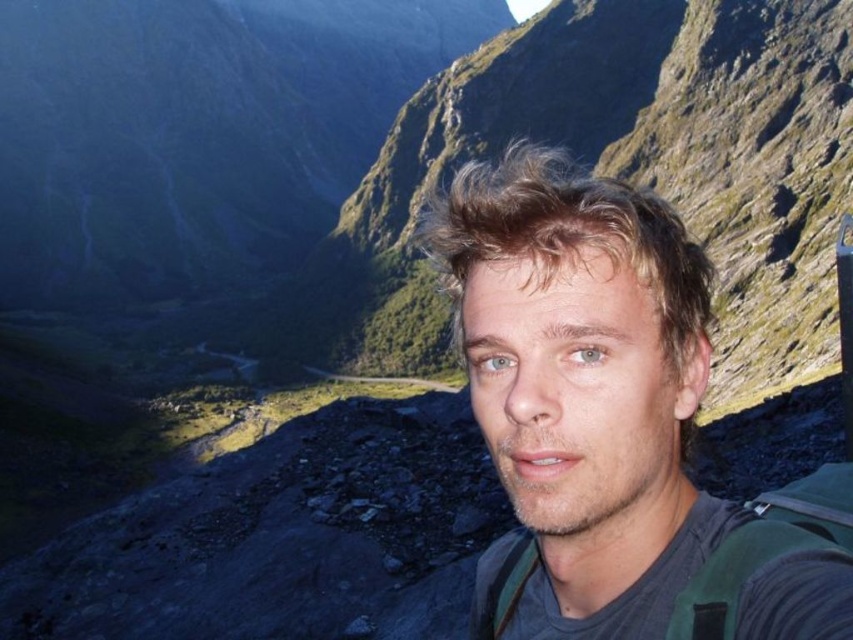
Question: Does blonde hair at center have a larger size compared to green fabric strap at lower right?

Choices:
 (A) no
 (B) yes

Answer: (B)

Question: Which point is closer to the camera?

Choices:
 (A) [602, 611]
 (B) [532, 554]

Answer: (A)

Question: Can you confirm if blonde hair at center is wider than green fabric backpack at center?

Choices:
 (A) yes
 (B) no

Answer: (A)

Question: Among these points, which one is nearest to the camera?

Choices:
 (A) (683, 428)
 (B) (730, 580)

Answer: (B)

Question: Which object is the closest to the blonde hair at center?

Choices:
 (A) green fabric backpack at center
 (B) green fabric strap at lower right

Answer: (B)

Question: Is blonde hair at center closer to the viewer compared to green fabric backpack at center?

Choices:
 (A) no
 (B) yes

Answer: (B)